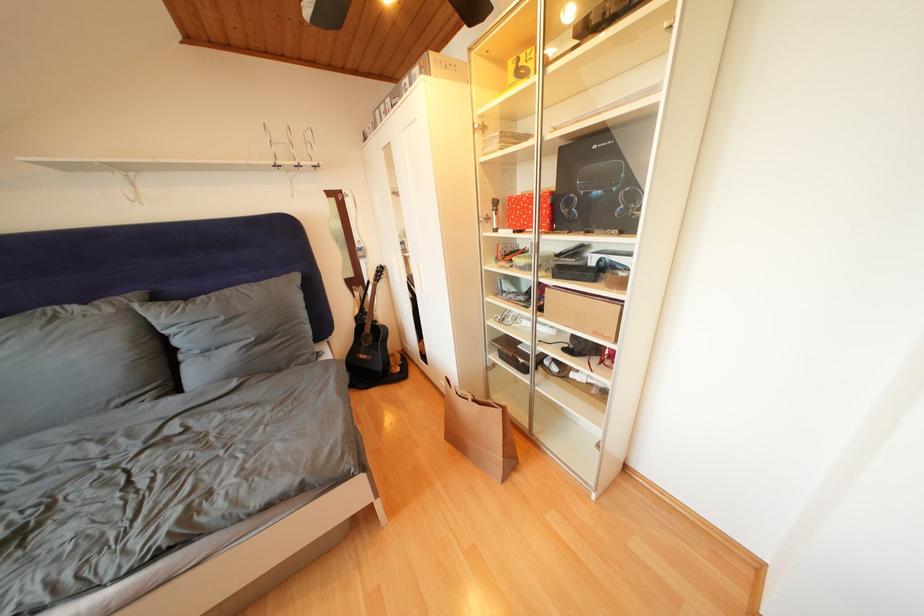
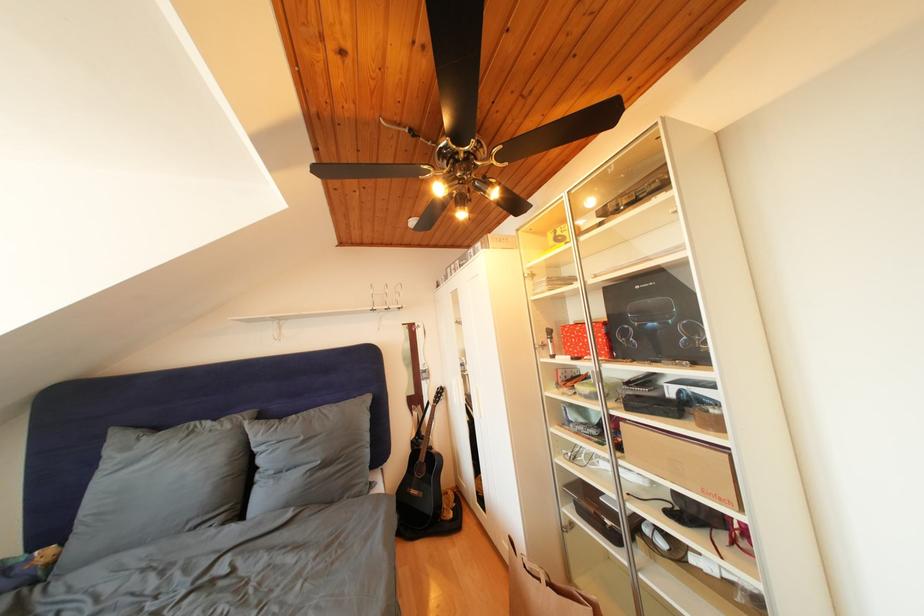
In the second image, find the point that corresponds to [481,406] in the first image.

(556, 590)